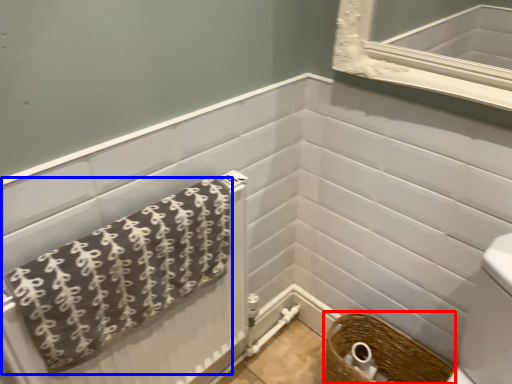
Question: Which object appears closest to the camera in this image, basket (highlighted by a red box) or towel (highlighted by a blue box)?

Choices:
 (A) basket
 (B) towel

Answer: (B)